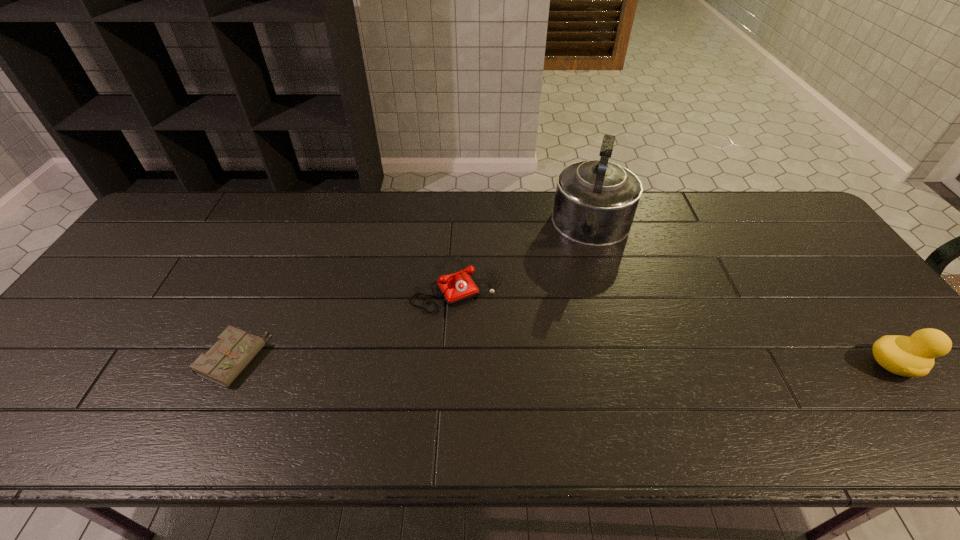
This screenshot has height=540, width=960. In order to click on vacant space at the far edge of the desktop in this screenshot , I will do `click(708, 222)`.

Find the location of `vacant space at the near edge of the desktop`. vacant space at the near edge of the desktop is located at coordinates (367, 374).

Image resolution: width=960 pixels, height=540 pixels. Find the location of `free location at the left edge`. free location at the left edge is located at coordinates point(139,305).

Where is `free space at the right edge of the desktop`? The image size is (960, 540). free space at the right edge of the desktop is located at coordinates (850, 298).

Locate an element on the screen. free space at the far left corner is located at coordinates pos(206,213).

In order to click on free point at the far right corner in this screenshot , I will do `click(746, 199)`.

Find the location of a particular element. The width and height of the screenshot is (960, 540). free spot between the rightmost object and the second object from right to left is located at coordinates (743, 296).

In order to click on vacant region between the tallest object and the duck in this screenshot , I will do point(743,296).

I want to click on free spot between the leftmost object and the third tallest object, so click(345, 322).

Locate an element on the screen. This screenshot has width=960, height=540. free space between the shortest object and the telephone is located at coordinates tap(345, 322).